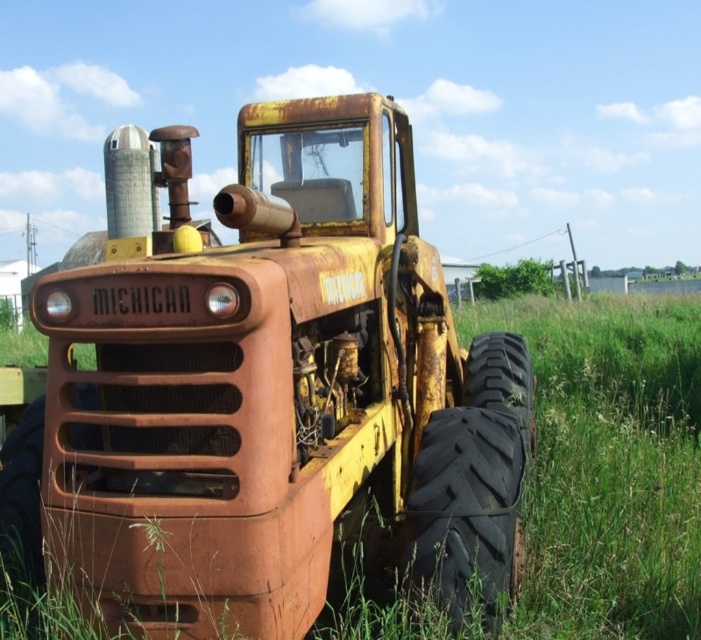
You are a farmer assessing the condition of your old equipment. You see the rusty metal tractor at center and the black rubber tire at lower right. Which object is bigger in size?

The rusty metal tractor at center is larger in size compared to the black rubber tire at lower right.